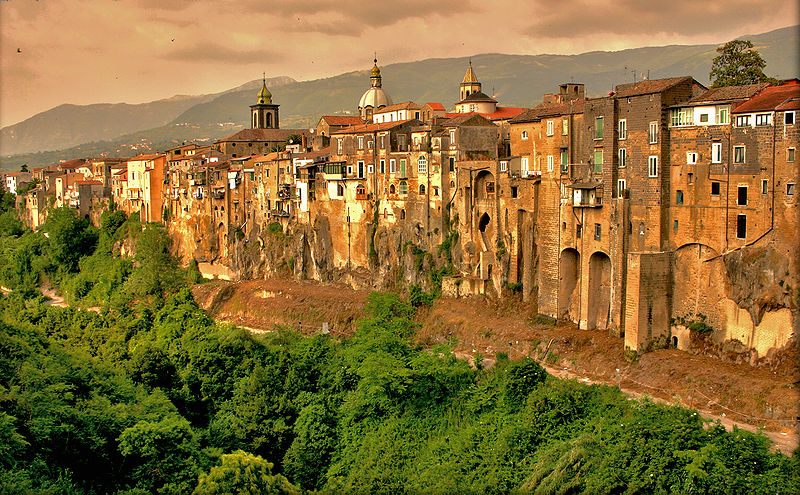
Where is `green window`? Image resolution: width=800 pixels, height=495 pixels. green window is located at coordinates (601, 130), (594, 162), (565, 159), (405, 169), (402, 189).